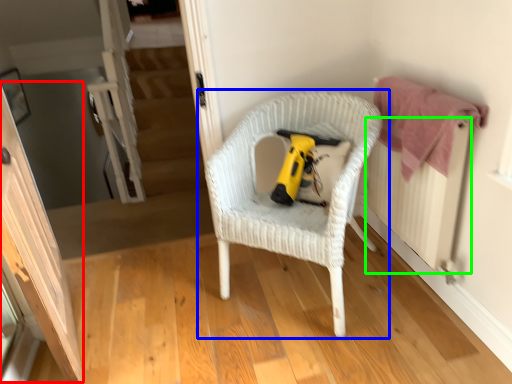
Question: Based on their relative distances, which object is nearer to screen door (highlighted by a red box)? Choose from chair (highlighted by a blue box) and radiator (highlighted by a green box).

Choices:
 (A) chair
 (B) radiator

Answer: (A)